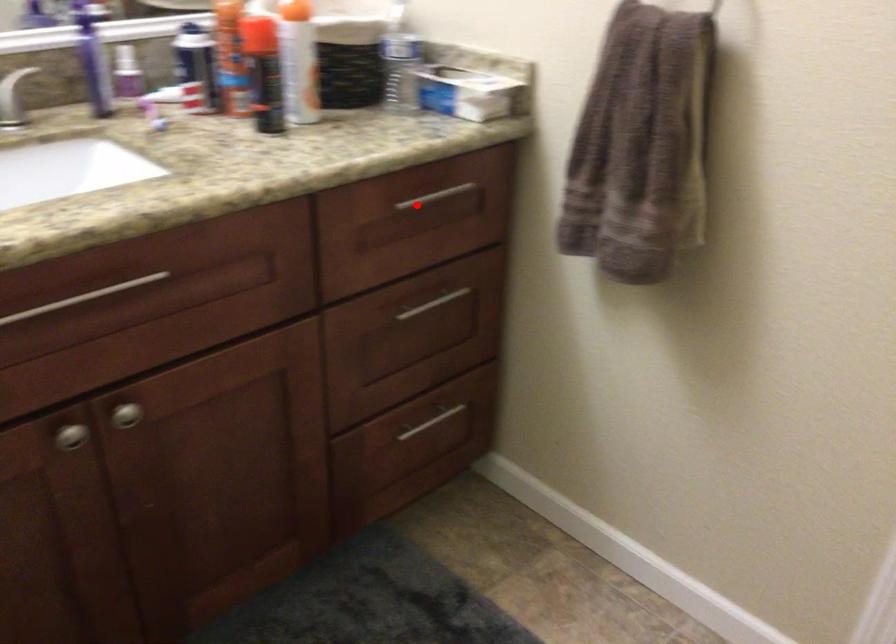
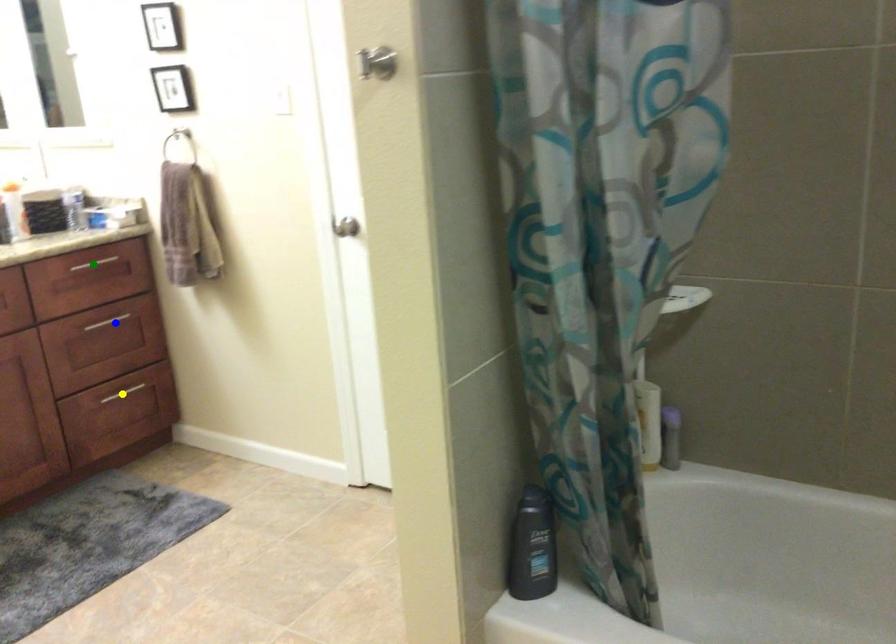
Question: I am providing you with two images of the same scene from different viewpoints. A red point is marked on the first image. You are given multiple points on the second image. Which spot in image 2 lines up with the point in image 1?

Choices:
 (A) green point
 (B) yellow point
 (C) blue point

Answer: (A)